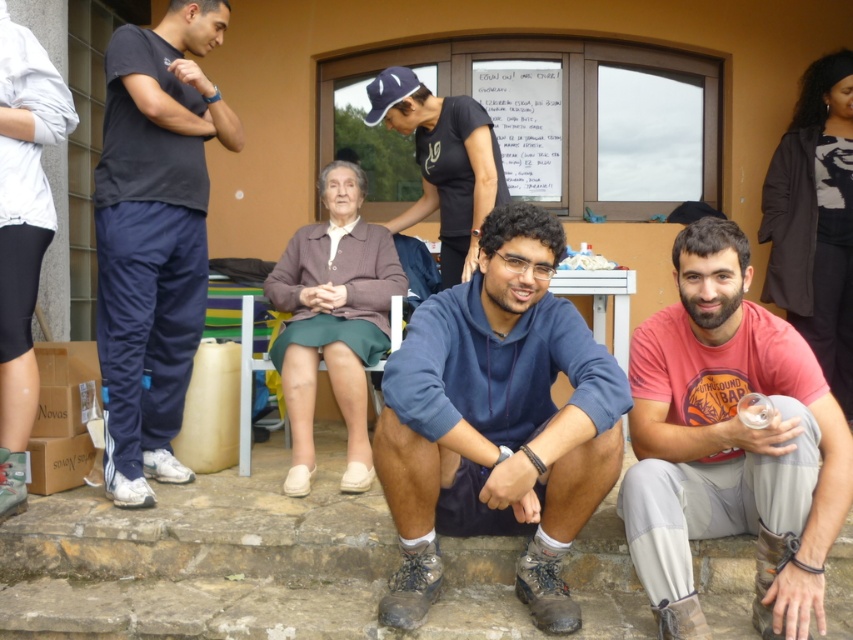
Who is more forward, (401,96) or (537,150)?

Positioned in front is point (401,96).

Is matte black shirt at center thinner than white paper at upper center?

In fact, matte black shirt at center might be wider than white paper at upper center.

Is point (450, 284) farther from viewer compared to point (537, 113)?

No, it is in front of (537, 113).

Where is `matte black shirt at center`? matte black shirt at center is located at coordinates (444, 163).

Between point (0, 468) and point (366, 92), which one is positioned behind?

Positioned behind is point (366, 92).

What do you see at coordinates (22, 234) in the screenshot? The height and width of the screenshot is (640, 853). I see `matte black shorts at lower left` at bounding box center [22, 234].

Image resolution: width=853 pixels, height=640 pixels. I want to click on matte black shorts at lower left, so click(x=22, y=234).

What are the coordinates of `matte black shorts at lower left` in the screenshot? It's located at (22, 234).

Measure the distance between blue fleece at center and white paper at upper center.

blue fleece at center and white paper at upper center are 2.89 meters apart from each other.

Is blue fleece at center bigger than white paper at upper center?

Indeed, blue fleece at center has a larger size compared to white paper at upper center.

Does point (579, 472) come closer to viewer compared to point (508, 97)?

Yes, it is.

Find the location of a particular element. Image resolution: width=853 pixels, height=640 pixels. blue fleece at center is located at coordinates (497, 422).